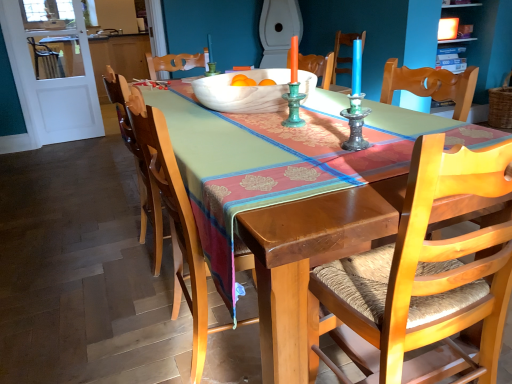
Question: Is white marble bowl at center smaller than wooden chair with woven seat at center, which is the second chair from left to right?

Choices:
 (A) no
 (B) yes

Answer: (B)

Question: Is white marble bowl at center at the left side of wooden chair with woven seat at center, which is the 1th chair in right-to-left order?

Choices:
 (A) no
 (B) yes

Answer: (B)

Question: Is white marble bowl at center at the right side of wooden chair with woven seat at center, which is the second chair from left to right?

Choices:
 (A) no
 (B) yes

Answer: (A)

Question: From a real-world perspective, is white marble bowl at center located beneath wooden chair with woven seat at center, which is the second chair from left to right?

Choices:
 (A) no
 (B) yes

Answer: (A)

Question: From the image's perspective, is white marble bowl at center on wooden chair with woven seat at center, which is the second chair from left to right?

Choices:
 (A) no
 (B) yes

Answer: (B)

Question: Is wooden chair with woven seat at center, which is the second chair from left to right, inside white marble bowl at center?

Choices:
 (A) no
 (B) yes

Answer: (A)

Question: Considering the relative positions of white glossy toilet at upper center and wooden chair with woven seat at center, the second chair from the right, in the image provided, is white glossy toilet at upper center to the right of wooden chair with woven seat at center, the second chair from the right, from the viewer's perspective?

Choices:
 (A) yes
 (B) no

Answer: (A)

Question: From the image's perspective, is white glossy toilet at upper center below wooden chair with woven seat at center, which ranks as the first chair in left-to-right order?

Choices:
 (A) no
 (B) yes

Answer: (A)

Question: Does white glossy toilet at upper center have a larger size compared to wooden chair with woven seat at center, which ranks as the first chair in left-to-right order?

Choices:
 (A) no
 (B) yes

Answer: (B)

Question: Can you confirm if white glossy toilet at upper center is wider than wooden chair with woven seat at center, the second chair from the right?

Choices:
 (A) yes
 (B) no

Answer: (A)

Question: Does white glossy toilet at upper center appear on the left side of wooden chair with woven seat at center, which ranks as the first chair in left-to-right order?

Choices:
 (A) yes
 (B) no

Answer: (B)

Question: Is wooden chair with woven seat at center, the second chair from the right, a part of white glossy toilet at upper center?

Choices:
 (A) yes
 (B) no

Answer: (B)

Question: Are white glossy toilet at upper center and white marble bowl at center far apart?

Choices:
 (A) no
 (B) yes

Answer: (B)